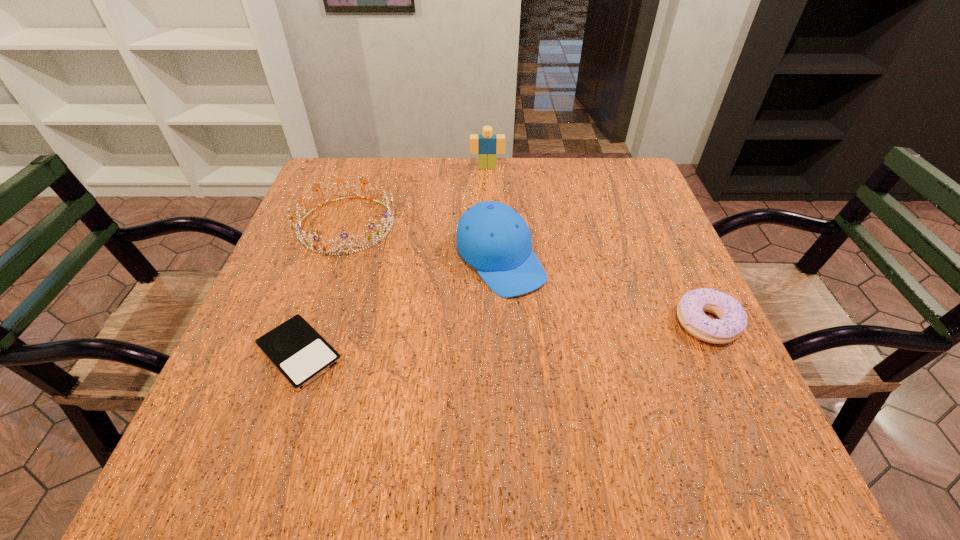
Image resolution: width=960 pixels, height=540 pixels. Find the location of `free space at the far right corner of the desktop`. free space at the far right corner of the desktop is located at coordinates (625, 184).

Where is `free spot at the near right corner of the desktop`? This screenshot has height=540, width=960. free spot at the near right corner of the desktop is located at coordinates (710, 388).

Identify the location of vacant space that's between the iPod and the cap. (400, 307).

Where is `free point between the shortest object and the farthest object`? free point between the shortest object and the farthest object is located at coordinates (394, 260).

Image resolution: width=960 pixels, height=540 pixels. I want to click on unoccupied position between the rightmost object and the farthest object, so click(597, 245).

I want to click on free space between the farthest object and the iPod, so click(x=394, y=260).

Where is `object that is the fourth closest one to the doughnut`? This screenshot has width=960, height=540. object that is the fourth closest one to the doughnut is located at coordinates (295, 348).

What are the coordinates of `the third closest object relative to the Lego` in the screenshot? It's located at (732, 321).

At what (x,y) coordinates should I click in order to perform the action: click on vacant space that satisfies the following two spatial constraints: 1. on the front side of the doughnut; 2. on the right side of the farthest object. Please return your answer as a coordinate pair (x, y). Looking at the image, I should click on (491, 323).